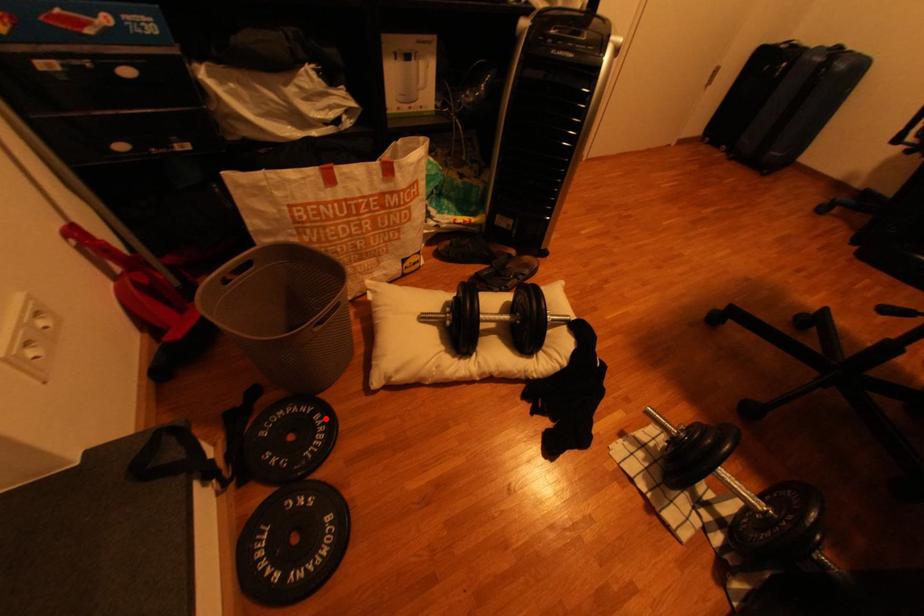
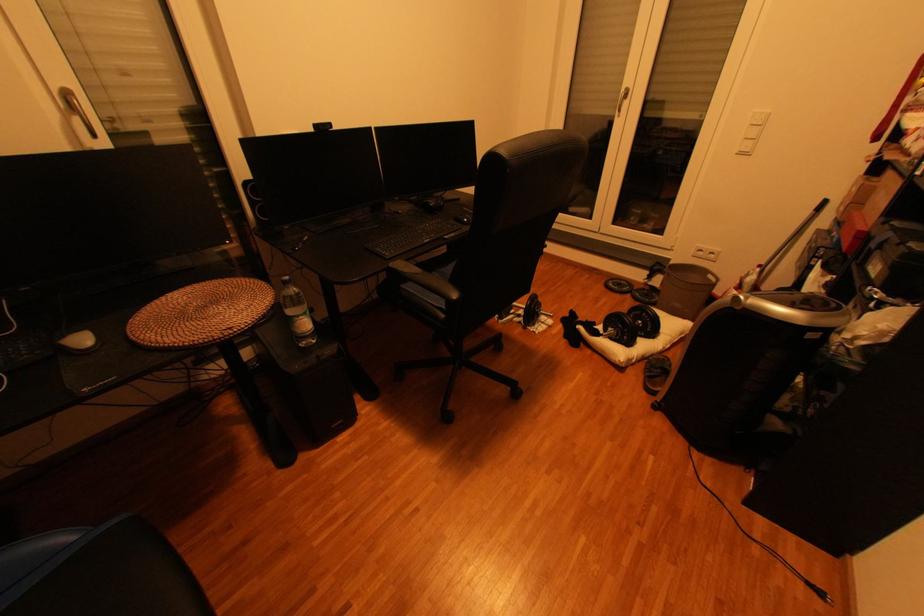
Where in the second image is the point corresponding to the highlighted location from the first image?

(658, 301)